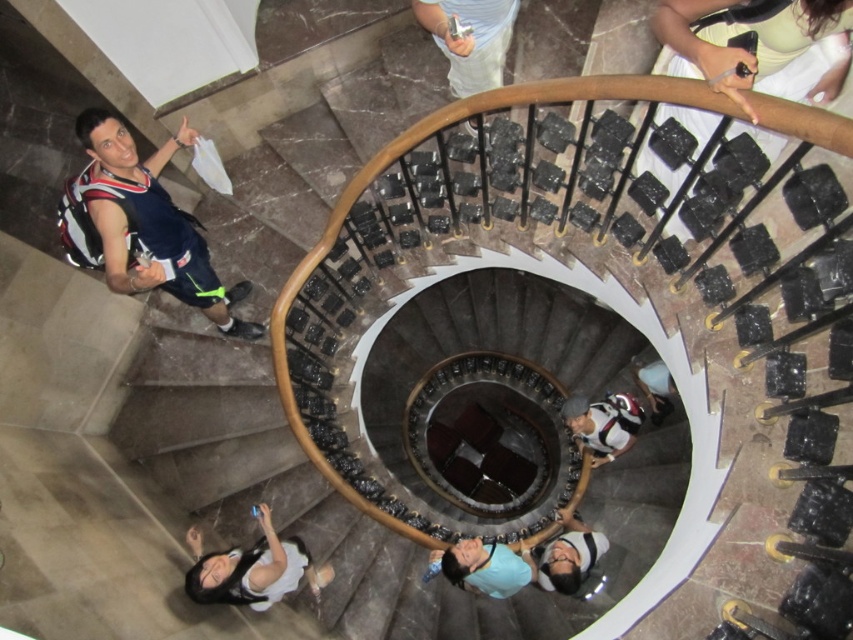
Question: Among these objects, which one is farthest from the camera?

Choices:
 (A) smooth beige handrail at upper right
 (B) matte blue shirt at left
 (C) white cotton shirt at lower center

Answer: (C)

Question: Which point is closer to the camera?

Choices:
 (A) matte black backpack at center
 (B) matte blue shirt at center
 (C) smooth beige handrail at upper right

Answer: (C)

Question: Observing the image, what is the correct spatial positioning of matte blue shirt at left in reference to matte white shirt at center?

Choices:
 (A) below
 (B) above

Answer: (B)

Question: Can you confirm if matte blue shirt at center is positioned above matte black backpack at center?

Choices:
 (A) no
 (B) yes

Answer: (A)

Question: Observing the image, what is the correct spatial positioning of matte blue shirt at left in reference to matte black backpack at center?

Choices:
 (A) left
 (B) right

Answer: (A)

Question: Estimate the real-world distances between objects in this image. Which object is closer to the white fabric at center?

Choices:
 (A) matte blue shirt at left
 (B) matte white shirt at center
 (C) white fabric shirt at lower center

Answer: (A)